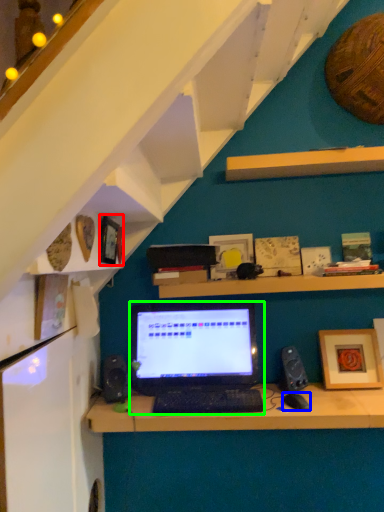
Question: Which object is the farthest from picture frame (highlighted by a red box)? Choose among these: computer mouse (highlighted by a blue box) or laptop (highlighted by a green box).

Choices:
 (A) computer mouse
 (B) laptop

Answer: (A)